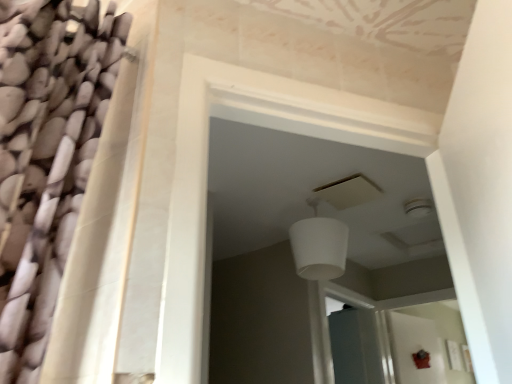
Question: Is white matte lampshade at center shorter than transparent glass screen door at center?

Choices:
 (A) yes
 (B) no

Answer: (A)

Question: Does white matte lampshade at center have a greater height compared to transparent glass screen door at center?

Choices:
 (A) yes
 (B) no

Answer: (B)

Question: From the image's perspective, is white matte lampshade at center beneath transparent glass screen door at center?

Choices:
 (A) no
 (B) yes

Answer: (A)

Question: Is white matte lampshade at center next to transparent glass screen door at center?

Choices:
 (A) yes
 (B) no

Answer: (B)

Question: Is white matte lampshade at center positioned far away from transparent glass screen door at center?

Choices:
 (A) yes
 (B) no

Answer: (A)

Question: Is the depth of white matte lampshade at center greater than that of transparent glass screen door at center?

Choices:
 (A) yes
 (B) no

Answer: (B)

Question: Is transparent glass screen door at center positioned with its back to white matte lampshade at center?

Choices:
 (A) yes
 (B) no

Answer: (B)

Question: From the image's perspective, would you say transparent glass screen door at center is positioned over white matte lampshade at center?

Choices:
 (A) no
 (B) yes

Answer: (A)

Question: From the image's perspective, would you say transparent glass screen door at center is shown under white matte lampshade at center?

Choices:
 (A) yes
 (B) no

Answer: (A)

Question: Can you confirm if transparent glass screen door at center is positioned to the left of white matte lampshade at center?

Choices:
 (A) yes
 (B) no

Answer: (B)

Question: Can you confirm if transparent glass screen door at center is shorter than white matte lampshade at center?

Choices:
 (A) no
 (B) yes

Answer: (A)

Question: Is transparent glass screen door at center smaller than white matte lampshade at center?

Choices:
 (A) no
 (B) yes

Answer: (A)

Question: Considering the positions of transparent glass screen door at center and white matte lampshade at center in the image, is transparent glass screen door at center bigger or smaller than white matte lampshade at center?

Choices:
 (A) small
 (B) big

Answer: (B)